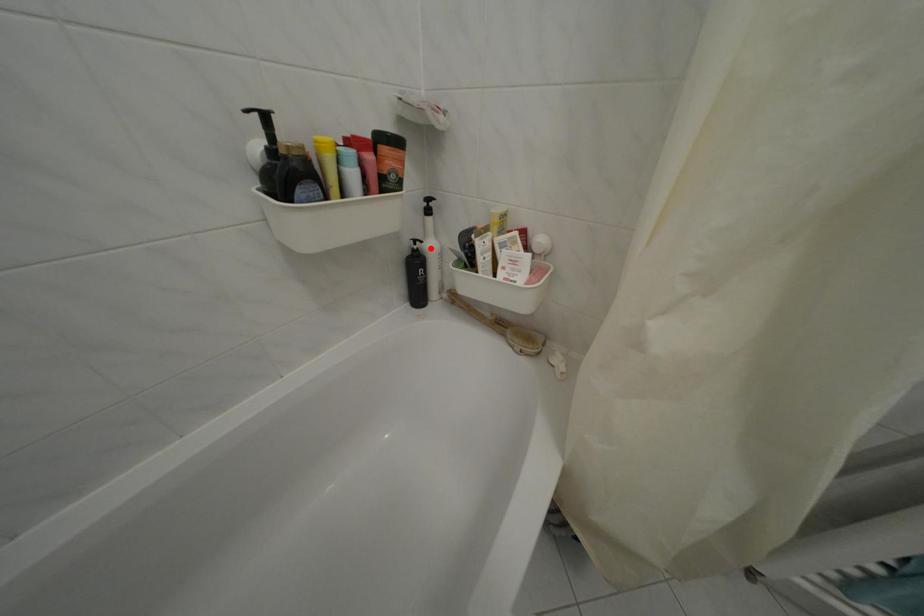
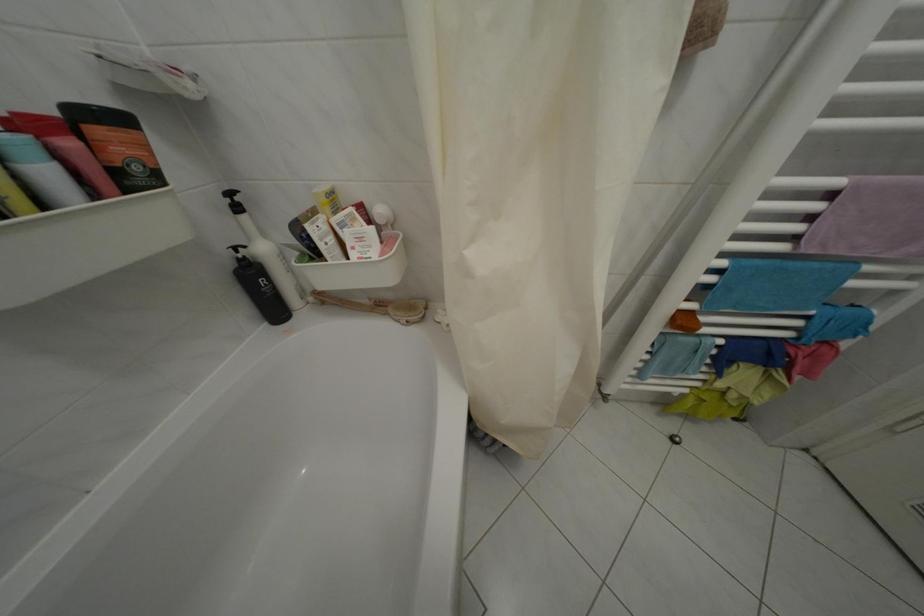
Find the pixel in the second image that matches the highlighted location in the first image.

(253, 254)